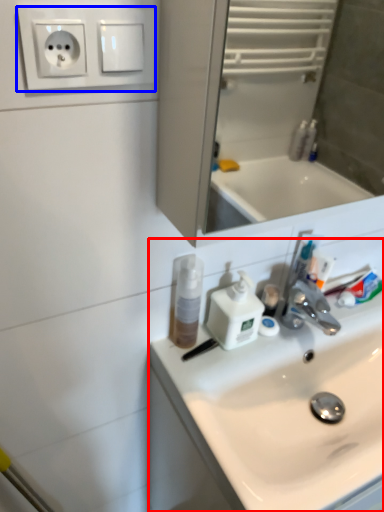
Question: Which point is further to the camera, sink (highlighted by a red box) or electric outlet (highlighted by a blue box)?

Choices:
 (A) sink
 (B) electric outlet

Answer: (A)